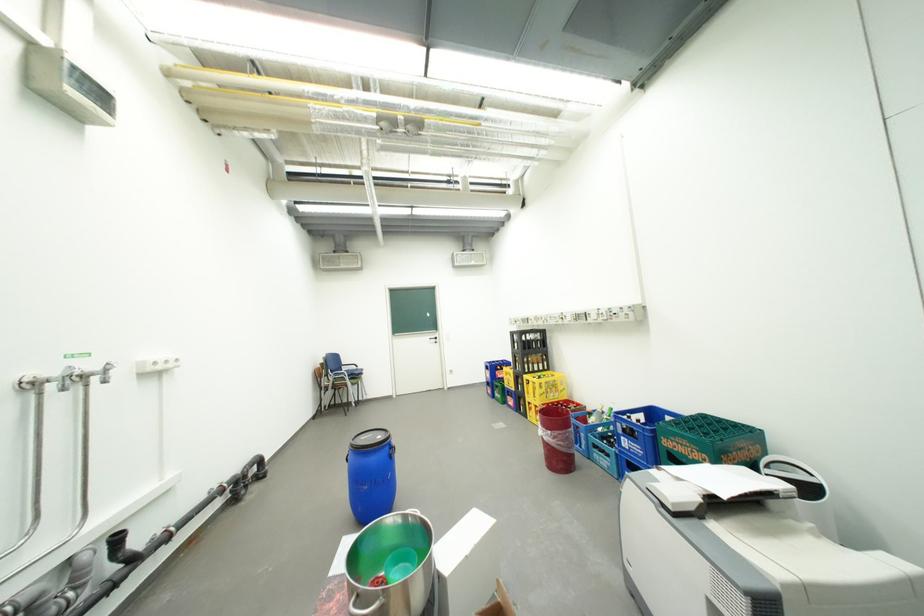
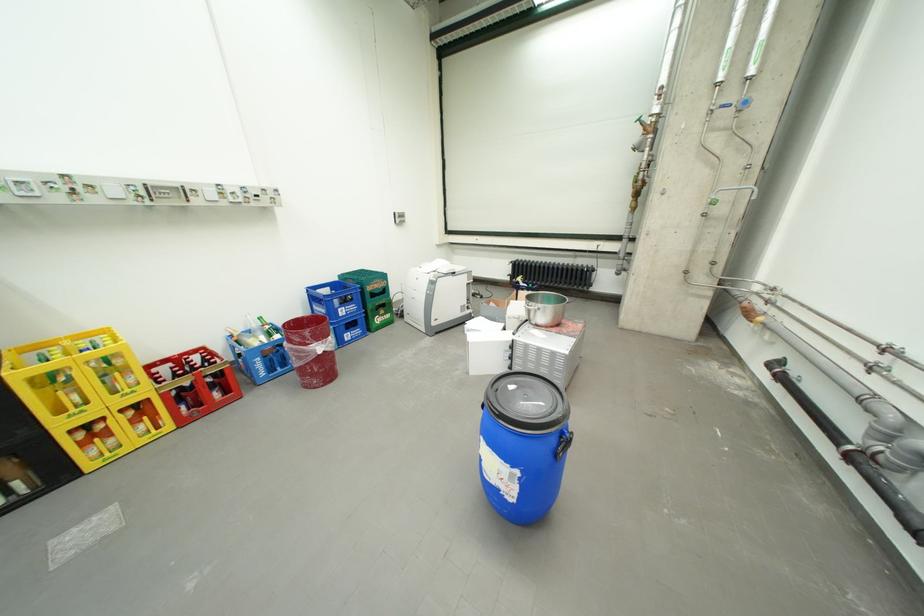
In the second image, find the point that corresponds to pixel 691 446 in the first image.

(386, 285)